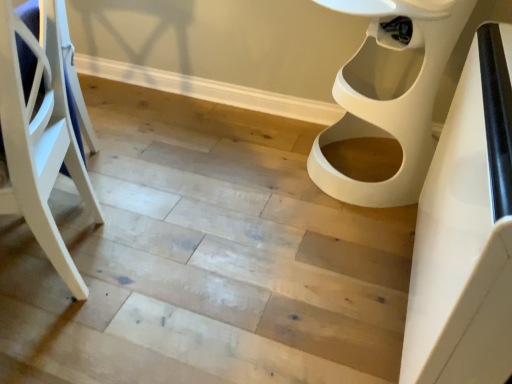
Question: Does white glossy table at right have a larger size compared to white plastic toilet at right?

Choices:
 (A) no
 (B) yes

Answer: (A)

Question: Does white glossy table at right appear on the right side of white plastic toilet at right?

Choices:
 (A) no
 (B) yes

Answer: (B)

Question: From a real-world perspective, is white glossy table at right located beneath white plastic toilet at right?

Choices:
 (A) yes
 (B) no

Answer: (B)

Question: From the image's perspective, is white glossy table at right under white plastic toilet at right?

Choices:
 (A) no
 (B) yes

Answer: (B)

Question: Is white glossy table at right beside white plastic toilet at right?

Choices:
 (A) yes
 (B) no

Answer: (B)

Question: Visually, is white glossy table at right positioned to the left or to the right of white plastic toilet at right?

Choices:
 (A) left
 (B) right

Answer: (B)

Question: In terms of height, does white glossy table at right look taller or shorter compared to white plastic toilet at right?

Choices:
 (A) short
 (B) tall

Answer: (A)

Question: In the image, is white glossy table at right positioned in front of or behind white plastic toilet at right?

Choices:
 (A) behind
 (B) front

Answer: (B)

Question: Based on their sizes in the image, would you say white glossy table at right is bigger or smaller than white plastic toilet at right?

Choices:
 (A) small
 (B) big

Answer: (A)

Question: Is point (409, 13) closer or farther from the camera than point (42, 119)?

Choices:
 (A) closer
 (B) farther

Answer: (B)

Question: Is white plastic toilet at right wider or thinner than white wood chair at left?

Choices:
 (A) thin
 (B) wide

Answer: (B)

Question: Based on their positions, is white plastic toilet at right located to the left or right of white wood chair at left?

Choices:
 (A) right
 (B) left

Answer: (A)

Question: From a real-world perspective, relative to white wood chair at left, is white plastic toilet at right vertically above or below?

Choices:
 (A) below
 (B) above

Answer: (A)

Question: In terms of width, does white plastic toilet at right look wider or thinner when compared to white glossy table at right?

Choices:
 (A) wide
 (B) thin

Answer: (A)

Question: Would you say white plastic toilet at right is to the left or to the right of white glossy table at right in the picture?

Choices:
 (A) right
 (B) left

Answer: (B)